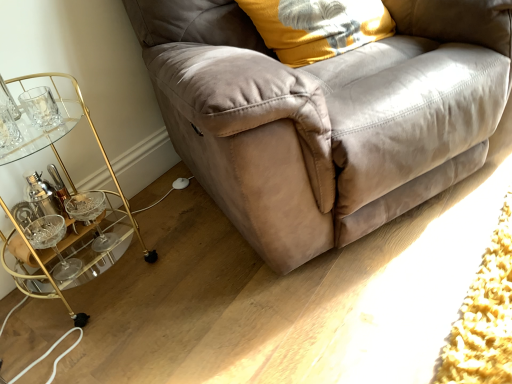
Question: Can you confirm if suede couch at center is shorter than soft yellow fabric pillow at upper right?

Choices:
 (A) no
 (B) yes

Answer: (A)

Question: Is there a large distance between suede couch at center and soft yellow fabric pillow at upper right?

Choices:
 (A) yes
 (B) no

Answer: (B)

Question: Is suede couch at center turned away from soft yellow fabric pillow at upper right?

Choices:
 (A) yes
 (B) no

Answer: (A)

Question: Is suede couch at center positioned before soft yellow fabric pillow at upper right?

Choices:
 (A) yes
 (B) no

Answer: (A)

Question: From the image's perspective, is suede couch at center below soft yellow fabric pillow at upper right?

Choices:
 (A) yes
 (B) no

Answer: (A)

Question: Considering the positions of suede couch at center and soft yellow fabric pillow at upper right in the image, is suede couch at center wider or thinner than soft yellow fabric pillow at upper right?

Choices:
 (A) wide
 (B) thin

Answer: (A)

Question: Is suede couch at center inside or outside of soft yellow fabric pillow at upper right?

Choices:
 (A) outside
 (B) inside

Answer: (A)

Question: Visually, is suede couch at center positioned to the left or to the right of soft yellow fabric pillow at upper right?

Choices:
 (A) left
 (B) right

Answer: (B)

Question: From the image's perspective, is suede couch at center positioned above or below soft yellow fabric pillow at upper right?

Choices:
 (A) below
 (B) above

Answer: (A)

Question: Considering the positions of soft yellow fabric pillow at upper right and gold metallic bar cart at left in the image, is soft yellow fabric pillow at upper right taller or shorter than gold metallic bar cart at left?

Choices:
 (A) short
 (B) tall

Answer: (A)

Question: Considering the positions of soft yellow fabric pillow at upper right and gold metallic bar cart at left in the image, is soft yellow fabric pillow at upper right wider or thinner than gold metallic bar cart at left?

Choices:
 (A) wide
 (B) thin

Answer: (B)

Question: From the image's perspective, is soft yellow fabric pillow at upper right positioned above or below gold metallic bar cart at left?

Choices:
 (A) above
 (B) below

Answer: (A)

Question: Considering their positions, is soft yellow fabric pillow at upper right located in front of or behind gold metallic bar cart at left?

Choices:
 (A) front
 (B) behind

Answer: (B)

Question: Is suede couch at center in front of or behind gold metallic bar cart at left in the image?

Choices:
 (A) front
 (B) behind

Answer: (A)

Question: In terms of width, does suede couch at center look wider or thinner when compared to gold metallic bar cart at left?

Choices:
 (A) wide
 (B) thin

Answer: (A)